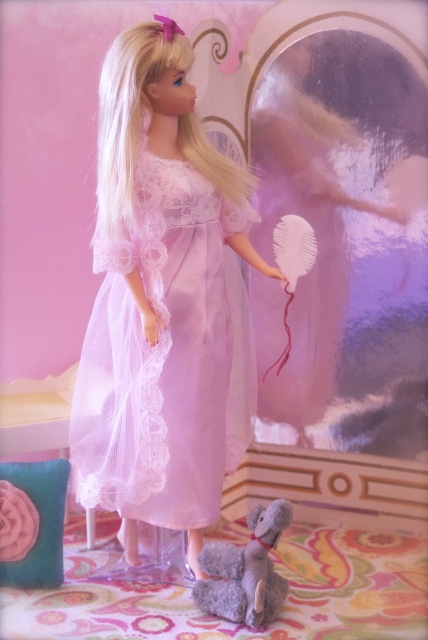
Does point (163, 481) lie behind point (255, 580)?

Yes, it is.

This screenshot has width=428, height=640. Identify the location of lace fabric dress at center. (166, 356).

This screenshot has height=640, width=428. I want to click on lace fabric dress at center, so click(x=166, y=356).